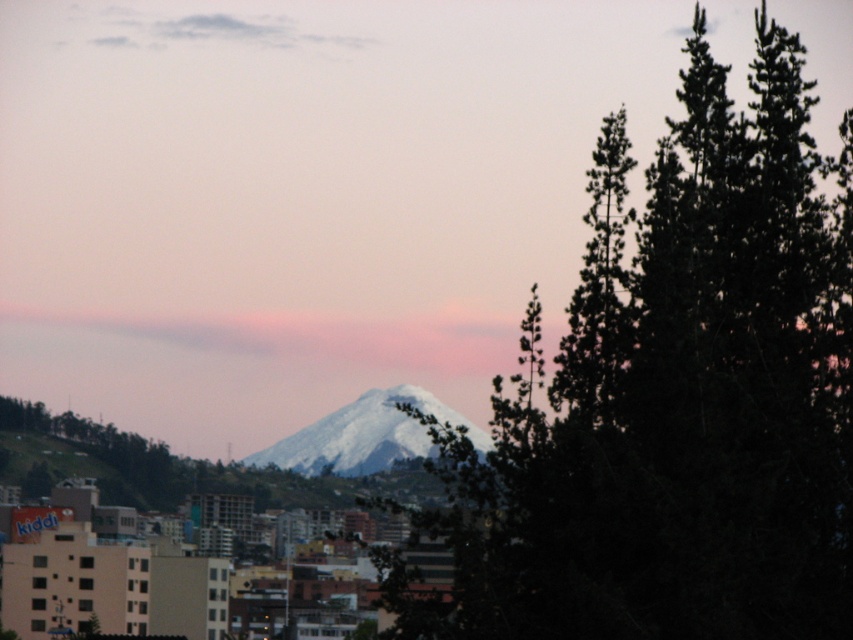
Can you confirm if dark green foliage at center is positioned below white snow-covered peak at center?

No, dark green foliage at center is not below white snow-covered peak at center.

The height and width of the screenshot is (640, 853). What are the coordinates of `dark green foliage at center` in the screenshot? It's located at (671, 400).

You are a GUI agent. You are given a task and a screenshot of the screen. Output one action in this format:
    pyautogui.click(x=<x>, y=<y>)
    Task: Click on the dark green foliage at center
    
    Given the screenshot: What is the action you would take?
    pyautogui.click(x=671, y=400)